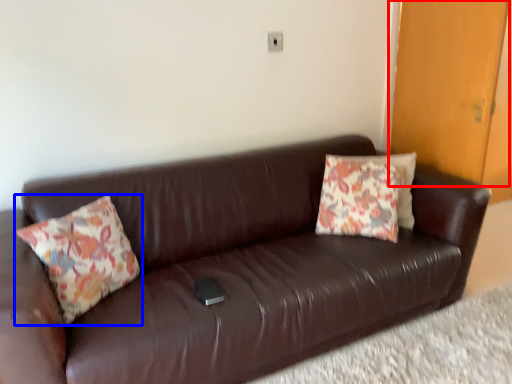
Question: Which point is further to the camera, door (highlighted by a red box) or pillow (highlighted by a blue box)?

Choices:
 (A) door
 (B) pillow

Answer: (A)